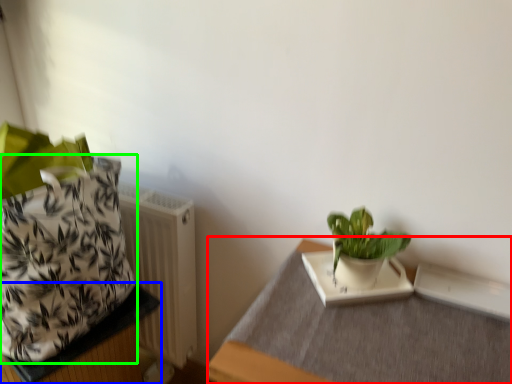
Question: Estimate the real-world distances between objects in this image. Which object is farther from table (highlighted by a red box), table (highlighted by a blue box) or flowerpot (highlighted by a green box)?

Choices:
 (A) table
 (B) flowerpot

Answer: (A)